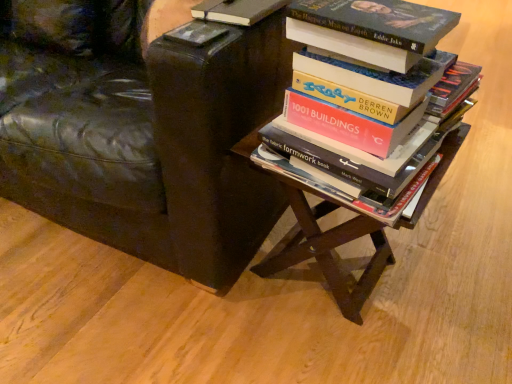
Question: Relative to hardcover book at upper left, which is the 1th book in top-to-bottom order, is wooden table at center in front or behind?

Choices:
 (A) behind
 (B) front

Answer: (B)

Question: Would you say wooden table at center is inside or outside hardcover book at upper left, which is the 1th book in top-to-bottom order?

Choices:
 (A) outside
 (B) inside

Answer: (A)

Question: Based on their relative distances, which object is farther from the hardcover book at center, the first book from the bottom?

Choices:
 (A) wooden table at center
 (B) black leather chair at upper left
 (C) hardcover book at upper left, which is the 1th book in top-to-bottom order

Answer: (B)

Question: Which of these objects is positioned closest to the wooden table at center?

Choices:
 (A) black leather chair at upper left
 (B) hardcover book at upper left, which is the 1th book in top-to-bottom order
 (C) hardcover book at center, the first book from the bottom

Answer: (C)